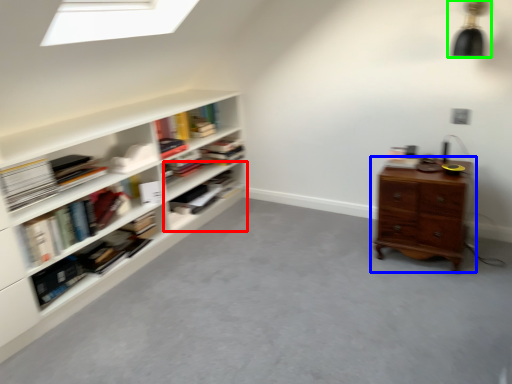
Question: Estimate the real-world distances between objects in this image. Which object is farther from shelf (highlighted by a red box), chest of drawers (highlighted by a blue box) or light fixture (highlighted by a green box)?

Choices:
 (A) chest of drawers
 (B) light fixture

Answer: (B)